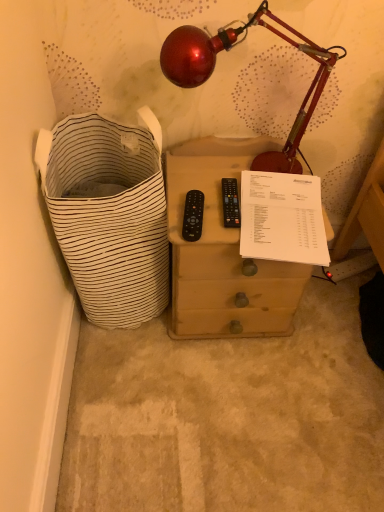
Question: Considering the relative sizes of black plastic remote at center, the 2th control positioned from the right, and white paper at upper right in the image provided, is black plastic remote at center, the 2th control positioned from the right, wider than white paper at upper right?

Choices:
 (A) no
 (B) yes

Answer: (A)

Question: Is black plastic remote at center, the 2th control positioned from the right, taller than white paper at upper right?

Choices:
 (A) yes
 (B) no

Answer: (B)

Question: Can you confirm if black plastic remote at center, the 2th control positioned from the right, is positioned to the left of white paper at upper right?

Choices:
 (A) yes
 (B) no

Answer: (A)

Question: Can you confirm if black plastic remote at center, the 2th control positioned from the right, is smaller than white paper at upper right?

Choices:
 (A) no
 (B) yes

Answer: (B)

Question: Is black plastic remote at center, the 2th control positioned from the right, next to white paper at upper right and touching it?

Choices:
 (A) yes
 (B) no

Answer: (B)

Question: Does black plastic remote at center, the 2th control positioned from the right, come in front of white paper at upper right?

Choices:
 (A) no
 (B) yes

Answer: (A)

Question: From a real-world perspective, does black plastic remote at center, which ranks as the first control in right-to-left order, sit lower than white paper at upper right?

Choices:
 (A) no
 (B) yes

Answer: (A)

Question: Considering the relative positions of black plastic remote at center, which ranks as the first control in right-to-left order, and white paper at upper right in the image provided, is black plastic remote at center, which ranks as the first control in right-to-left order, behind white paper at upper right?

Choices:
 (A) yes
 (B) no

Answer: (A)

Question: Can we say black plastic remote at center, which ranks as the first control in right-to-left order, lies outside white paper at upper right?

Choices:
 (A) yes
 (B) no

Answer: (A)

Question: Considering the relative sizes of black plastic remote at center, the second control when ordered from left to right, and white paper at upper right in the image provided, is black plastic remote at center, the second control when ordered from left to right, wider than white paper at upper right?

Choices:
 (A) yes
 (B) no

Answer: (B)

Question: Is black plastic remote at center, the second control when ordered from left to right, to the left of white paper at upper right from the viewer's perspective?

Choices:
 (A) no
 (B) yes

Answer: (B)

Question: Considering the relative sizes of black plastic remote at center, which ranks as the first control in right-to-left order, and white paper at upper right in the image provided, is black plastic remote at center, which ranks as the first control in right-to-left order, smaller than white paper at upper right?

Choices:
 (A) yes
 (B) no

Answer: (A)

Question: Is white striped fabric laundry basket at left to the right of black plastic remote at center, the 2th control positioned from the right, from the viewer's perspective?

Choices:
 (A) yes
 (B) no

Answer: (B)